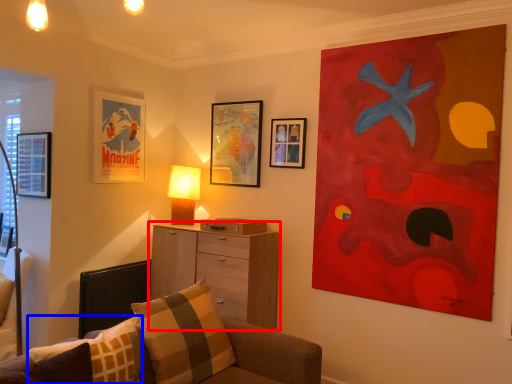
Question: Among these objects, which one is farthest to the camera, chest of drawers (highlighted by a red box) or pillow (highlighted by a blue box)?

Choices:
 (A) chest of drawers
 (B) pillow

Answer: (A)